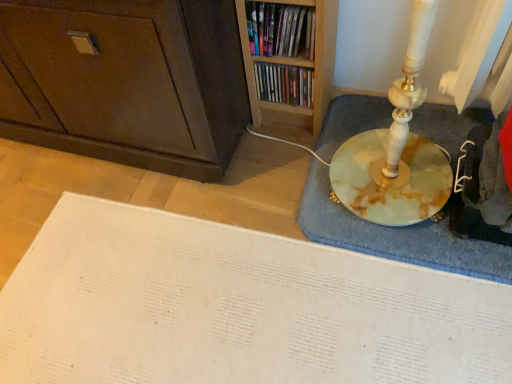
You are a GUI agent. You are given a task and a screenshot of the screen. Output one action in this format:
    pyautogui.click(x=<x>, y=<y>)
    Task: Click on the blank space situated above marble bath mat at right (from a real-world perspective)
    
    Given the screenshot: What is the action you would take?
    pyautogui.click(x=391, y=173)